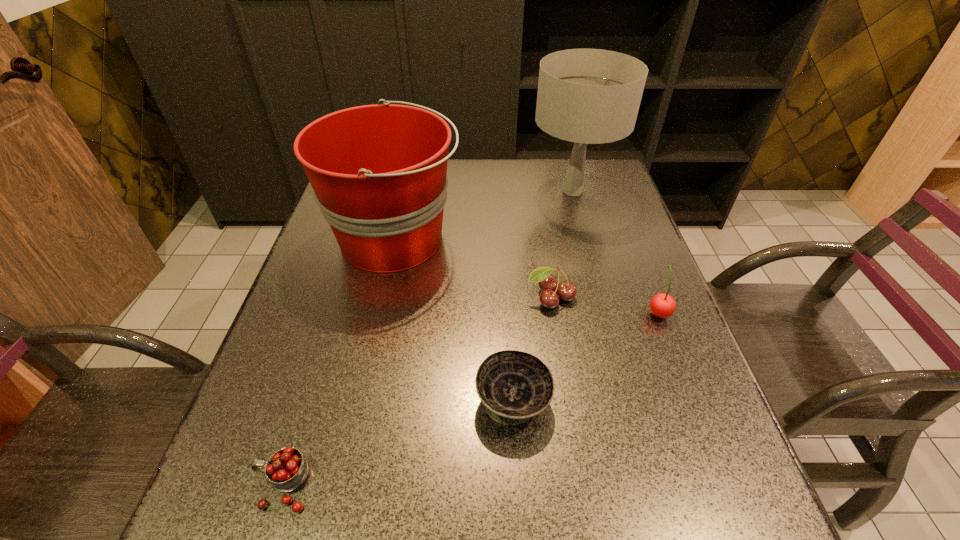
Locate an element on the screen. The width and height of the screenshot is (960, 540). the tallest object is located at coordinates (587, 96).

You are a GUI agent. You are given a task and a screenshot of the screen. Output one action in this format:
    pyautogui.click(x=<x>, y=<y>)
    Task: Click on the fifth shortest object
    This screenshot has height=540, width=960.
    Given the screenshot: What is the action you would take?
    pyautogui.click(x=379, y=172)

You are a GUI agent. You are given a task and a screenshot of the screen. Output one action in this format:
    pyautogui.click(x=<x>, y=<y>)
    Task: Click on the third tallest object
    This screenshot has height=540, width=960.
    Given the screenshot: What is the action you would take?
    pyautogui.click(x=662, y=305)

I want to click on the tallest cherry, so click(x=662, y=305).

You are a GUI agent. You are given a task and a screenshot of the screen. Output one action in this format:
    pyautogui.click(x=<x>, y=<y>)
    Task: Click on the second cherry from right to left
    This screenshot has height=540, width=960.
    Given the screenshot: What is the action you would take?
    pyautogui.click(x=566, y=290)

Where is `the nearest object`? the nearest object is located at coordinates (286, 469).

Where is `the nearest cherry`? This screenshot has height=540, width=960. the nearest cherry is located at coordinates (286, 469).

Locate an element on the screen. Image resolution: width=960 pixels, height=540 pixels. bowl is located at coordinates (514, 386).

Where is `the shortest object`? Image resolution: width=960 pixels, height=540 pixels. the shortest object is located at coordinates (514, 386).

This screenshot has height=540, width=960. What are the coordinates of `vacant position located on the front-facing side of the tallest object` in the screenshot? It's located at (403, 191).